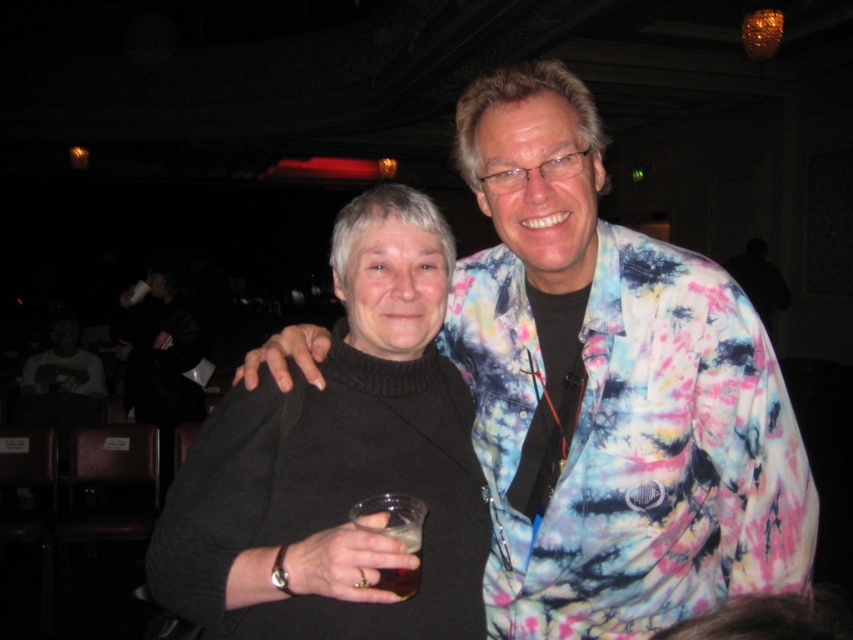
Question: Can you confirm if tie-dye jacket at center is bigger than translucent glass at lower center?

Choices:
 (A) no
 (B) yes

Answer: (B)

Question: Which of the following is the closest to the observer?

Choices:
 (A) black sweater at center
 (B) tie-dye jacket at center

Answer: (A)

Question: Does black sweater at center appear on the right side of translucent glass at lower center?

Choices:
 (A) yes
 (B) no

Answer: (B)

Question: Which point is closer to the camera?

Choices:
 (A) black sweater at center
 (B) tie-dye jacket at center
 (C) translucent glass at lower center

Answer: (A)

Question: Is tie-dye jacket at center to the right of black sweater at center from the viewer's perspective?

Choices:
 (A) no
 (B) yes

Answer: (B)

Question: Which of the following is the closest to the observer?

Choices:
 (A) translucent glass at lower center
 (B) black sweater at center
 (C) tie-dye jacket at center

Answer: (B)